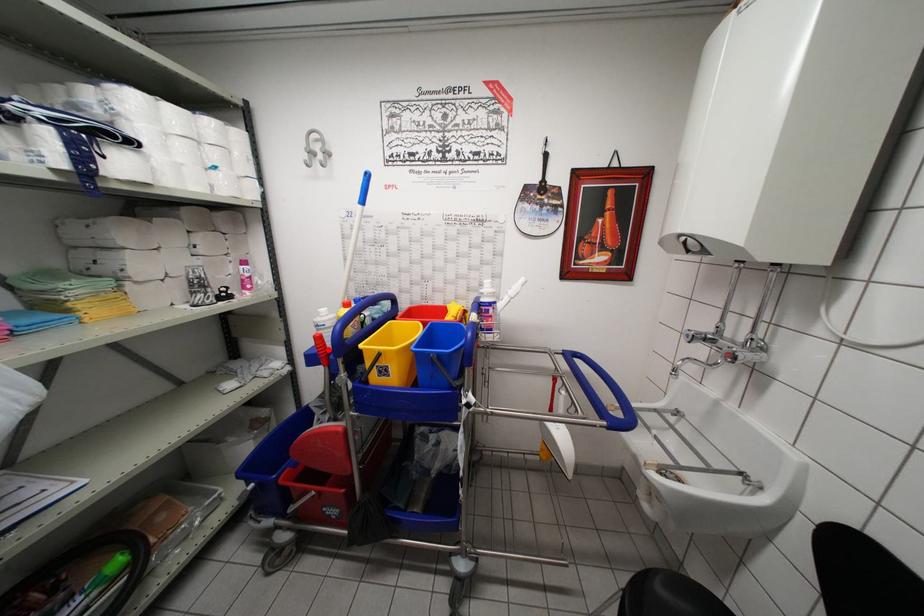
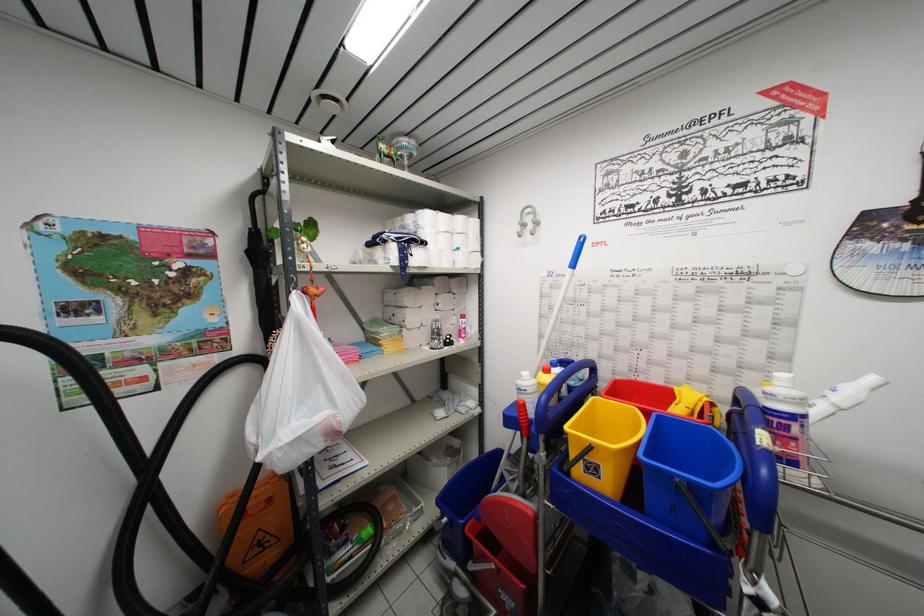
In the second image, find the point that corresponds to the highlighted location in the first image.

(530, 419)